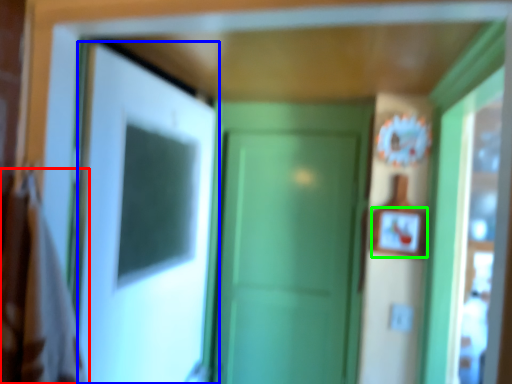
Question: Which object is the farthest from laundry (highlighted by a red box)? Choose among these: door (highlighted by a blue box) or picture frame (highlighted by a green box).

Choices:
 (A) door
 (B) picture frame

Answer: (B)